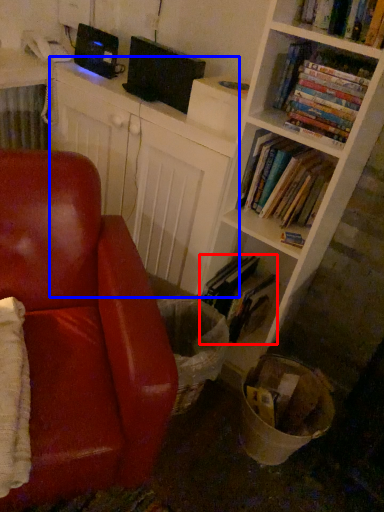
Question: Which object appears farthest to the camera in this image, book (highlighted by a red box) or computer (highlighted by a blue box)?

Choices:
 (A) book
 (B) computer

Answer: (A)